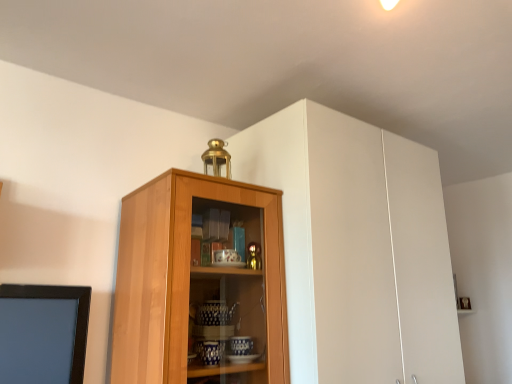
Question: Should I look upward or downward to see white matte cabinet at upper center?

Choices:
 (A) down
 (B) up

Answer: (A)

Question: Considering the relative sizes of white matte cabinet at upper center and light brown wood cabinet at center in the image provided, is white matte cabinet at upper center shorter than light brown wood cabinet at center?

Choices:
 (A) yes
 (B) no

Answer: (B)

Question: From the image's perspective, does white matte cabinet at upper center appear higher than light brown wood cabinet at center?

Choices:
 (A) no
 (B) yes

Answer: (B)

Question: Considering the relative sizes of white matte cabinet at upper center and light brown wood cabinet at center in the image provided, is white matte cabinet at upper center taller than light brown wood cabinet at center?

Choices:
 (A) yes
 (B) no

Answer: (A)

Question: From a real-world perspective, is white matte cabinet at upper center physically above light brown wood cabinet at center?

Choices:
 (A) no
 (B) yes

Answer: (B)

Question: Is there a large distance between white matte cabinet at upper center and light brown wood cabinet at center?

Choices:
 (A) yes
 (B) no

Answer: (B)

Question: Is white matte cabinet at upper center further to the viewer compared to light brown wood cabinet at center?

Choices:
 (A) no
 (B) yes

Answer: (B)

Question: Can you confirm if light brown wood cabinet at center is shorter than white matte cabinet at upper center?

Choices:
 (A) no
 (B) yes

Answer: (B)

Question: From the image's perspective, does light brown wood cabinet at center appear lower than white matte cabinet at upper center?

Choices:
 (A) yes
 (B) no

Answer: (A)

Question: Is light brown wood cabinet at center smaller than white matte cabinet at upper center?

Choices:
 (A) yes
 (B) no

Answer: (A)

Question: From the image's perspective, is light brown wood cabinet at center on white matte cabinet at upper center?

Choices:
 (A) no
 (B) yes

Answer: (A)

Question: Is light brown wood cabinet at center to the left of white matte cabinet at upper center from the viewer's perspective?

Choices:
 (A) no
 (B) yes

Answer: (B)

Question: Is light brown wood cabinet at center closer to camera compared to white matte cabinet at upper center?

Choices:
 (A) no
 (B) yes

Answer: (B)

Question: Considering the positions of light brown wood cabinet at center and white matte cabinet at upper center in the image, is light brown wood cabinet at center wider or thinner than white matte cabinet at upper center?

Choices:
 (A) thin
 (B) wide

Answer: (A)